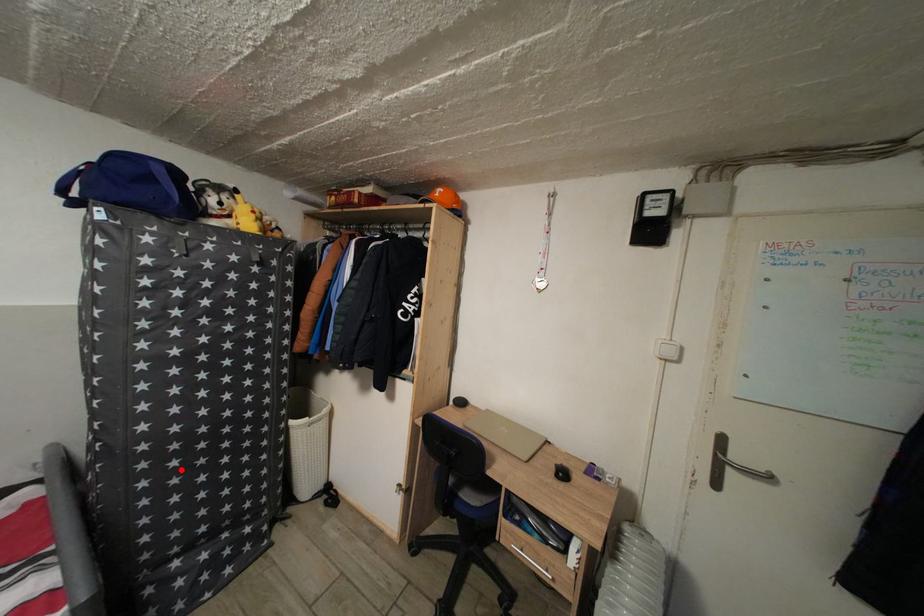
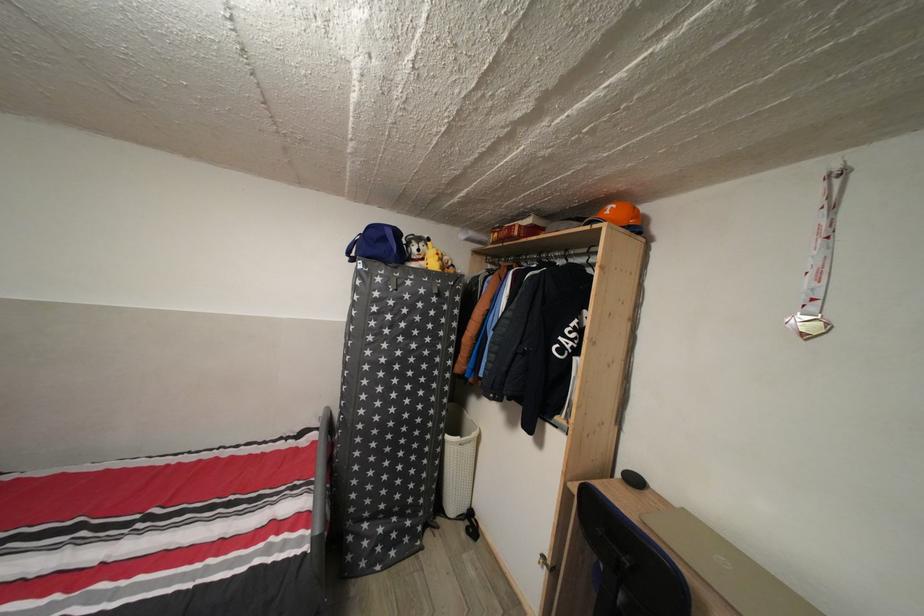
Where in the second image is the point corresponding to the highlighted location from the first image?

(380, 451)